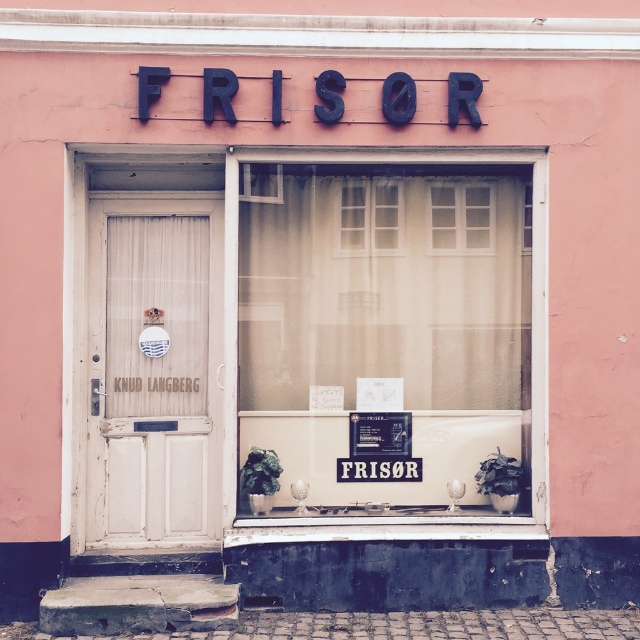
Between white wooden door at left and white paper at center, which one appears on the left side from the viewer's perspective?

white wooden door at left is more to the left.

Between white wooden door at left and white paper at center, which one has less height?

white paper at center

The height and width of the screenshot is (640, 640). Find the location of `white wooden door at left`. white wooden door at left is located at coordinates (154, 369).

Can you confirm if translucent fabric at center is thinner than white wooden door at left?

No.

Does translucent fabric at center have a larger size compared to white wooden door at left?

Correct, translucent fabric at center is larger in size than white wooden door at left.

Locate an element on the screen. This screenshot has width=640, height=640. translucent fabric at center is located at coordinates (392, 337).

This screenshot has height=640, width=640. In order to click on translucent fabric at center in this screenshot , I will do `click(392, 337)`.

Is translucent fabric at center to the right of white paper at center from the viewer's perspective?

Indeed, translucent fabric at center is positioned on the right side of white paper at center.

Does translucent fabric at center have a lesser width compared to white paper at center?

No.

Where is `translucent fabric at center`? The image size is (640, 640). translucent fabric at center is located at coordinates (392, 337).